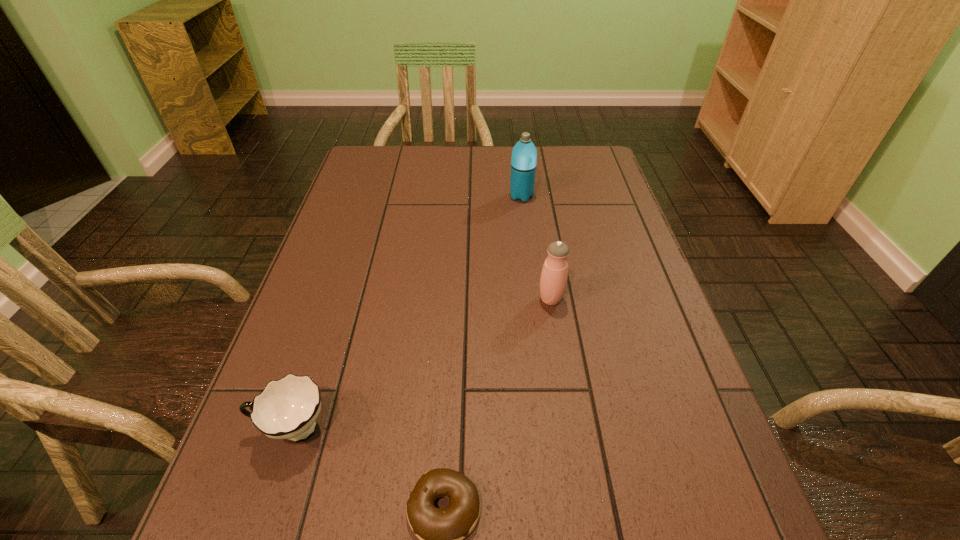
Where is `free space at the left edge of the desktop`? The width and height of the screenshot is (960, 540). free space at the left edge of the desktop is located at coordinates (284, 482).

Identify the location of vacant space at the right edge of the desktop. (639, 317).

You are a GUI agent. You are given a task and a screenshot of the screen. Output one action in this format:
    pyautogui.click(x=<x>, y=<y>)
    Task: Click on the free space at the far left corner of the desktop
    This screenshot has width=960, height=540.
    Given the screenshot: What is the action you would take?
    pyautogui.click(x=372, y=180)

This screenshot has height=540, width=960. Find the location of `vacant region at the far right corner of the desktop`. vacant region at the far right corner of the desktop is located at coordinates (577, 178).

Where is `vacant region between the cup and the second farthest object`? This screenshot has height=540, width=960. vacant region between the cup and the second farthest object is located at coordinates (421, 364).

You are a GUI agent. You are given a task and a screenshot of the screen. Output one action in this format:
    pyautogui.click(x=<x>, y=<y>)
    Task: Click on the empty location between the leftmost object and the shorter thermos bottle
    
    Given the screenshot: What is the action you would take?
    pyautogui.click(x=421, y=364)

Where is `free space between the tallest object and the third farthest object`? free space between the tallest object and the third farthest object is located at coordinates (407, 313).

I want to click on vacant area that lies between the second farthest object and the leftmost object, so click(x=421, y=364).

Where is `vacant space that is in between the tallest object and the third farthest object`? vacant space that is in between the tallest object and the third farthest object is located at coordinates (407, 313).

Where is `free area in between the taller thermos bottle and the nearer thermos bottle`? free area in between the taller thermos bottle and the nearer thermos bottle is located at coordinates (536, 248).